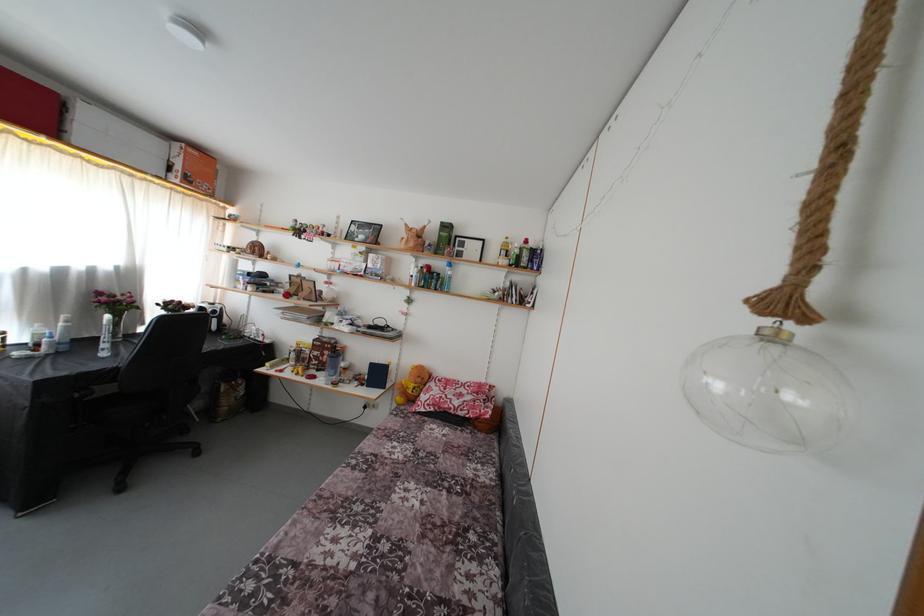
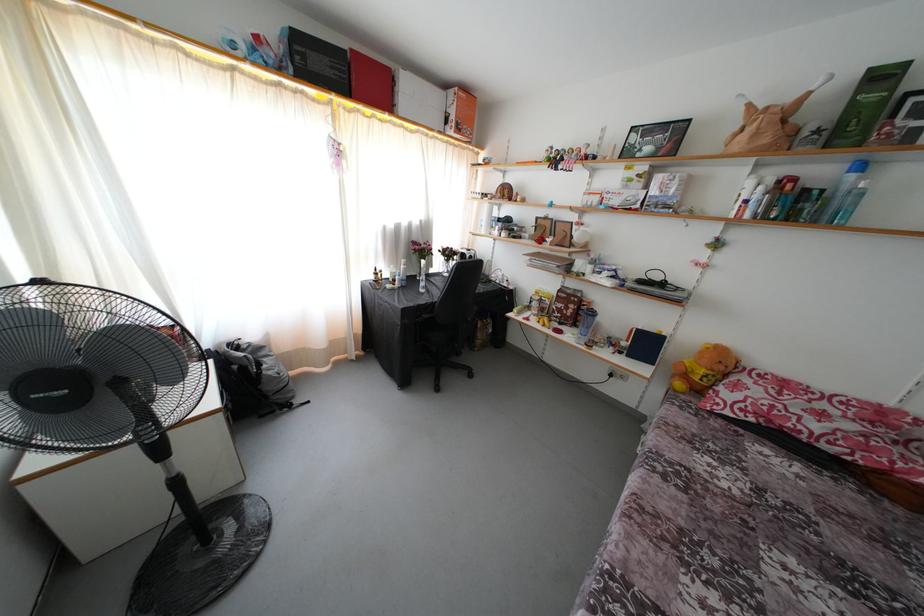
The point at (424, 386) is marked in the first image. Where is the corresponding point in the second image?

(726, 373)